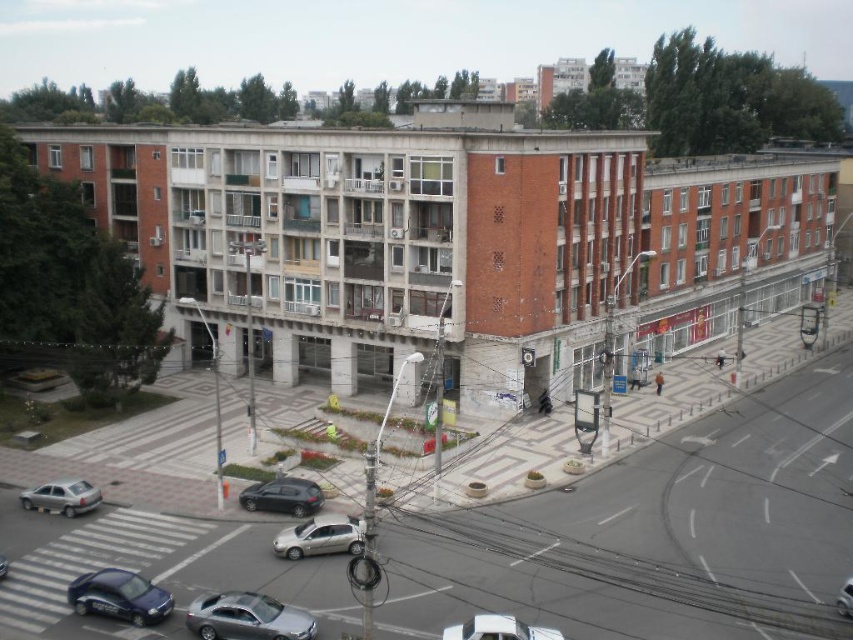
You are a delivery person trying to park your silver metallic car at lower center in the plaza. There is a metallic silver car at center already parked. Considering the height of the two cars, which car would require more vertical clearance when exiting the plaza through a low bridge that is 1.8 meters tall?

The silver metallic car at lower center is much taller than the metallic silver car at center, so it would require more vertical clearance to pass under the low bridge that is 1.8 meters tall.

You are a delivery person needing to park your vehicle in a narrow alley that can only accommodate vehicles up to 1.8 meters wide. You have a matte silver sedan at lower left and a shiny silver car at lower center. Which car should you choose to park in the alley?

The shiny silver car at lower center should be chosen because the matte silver sedan at lower left is wider, exceeding the alley width limit. Since the shiny silver car at lower center is narrower, it will fit within the 1.8 meters width requirement.

You are a delivery driver trying to park your vehicle in the plaza in front of the residential building. Your vehicle is 1.8 meters wide. The plaza has a narrow pathway between the silver metallic car at center and the sleek silver sedan at lower center. Can your vehicle fit through this pathway?

The silver metallic car at center might be wider than sleek silver sedan at lower center, so the pathway between them may not be wide enough for your vehicle which is 1.8 meters wide. You should check the exact width before attempting to pass.